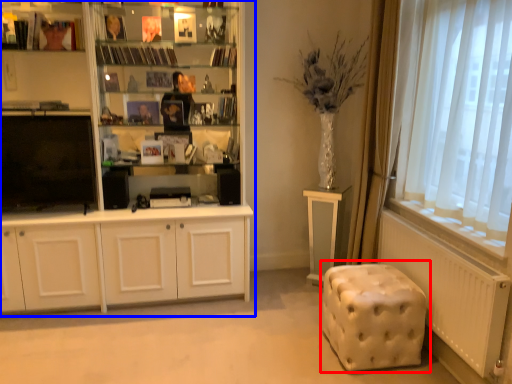
Question: Which object appears farthest to the camera in this image, music stool (highlighted by a red box) or cupboard (highlighted by a blue box)?

Choices:
 (A) music stool
 (B) cupboard

Answer: (B)